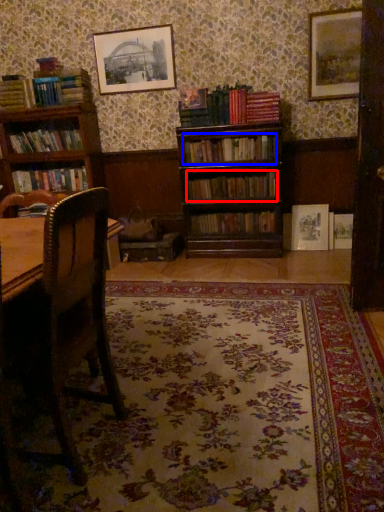
Question: Among these objects, which one is nearest to the camera, book (highlighted by a red box) or book (highlighted by a blue box)?

Choices:
 (A) book
 (B) book

Answer: (B)